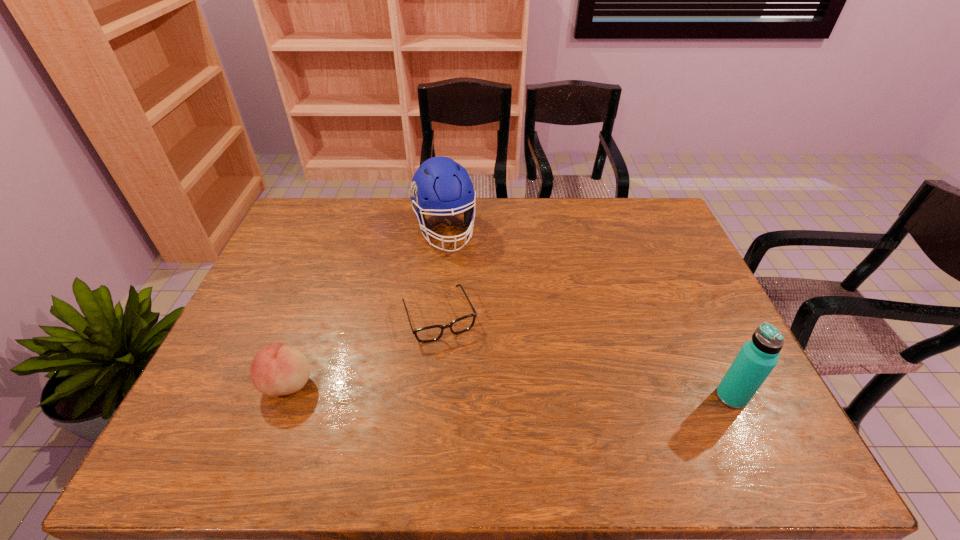
Identify the location of the second shortest object. (276, 370).

I want to click on the leftmost object, so click(x=276, y=370).

Identify the location of the rightmost object. The width and height of the screenshot is (960, 540). (757, 358).

At what (x,y) coordinates should I click in order to perform the action: click on the farthest object. Please return your answer as a coordinate pair (x, y). The image size is (960, 540). Looking at the image, I should click on (440, 185).

Image resolution: width=960 pixels, height=540 pixels. What are the coordinates of `the third nearest object` in the screenshot? It's located at (432, 333).

Where is `the shortest object`? Image resolution: width=960 pixels, height=540 pixels. the shortest object is located at coordinates (432, 333).

Image resolution: width=960 pixels, height=540 pixels. Identify the location of vacant region located on the right of the peach. (368, 383).

Find the location of a particular element. This screenshot has width=960, height=540. vacant space positioned on the left of the rightmost object is located at coordinates (552, 397).

Find the location of a particular element. Image resolution: width=960 pixels, height=540 pixels. vacant space located 0.370m on the front-facing side of the farthest object is located at coordinates (484, 342).

The image size is (960, 540). I want to click on vacant space located 0.370m on the front-facing side of the farthest object, so click(x=484, y=342).